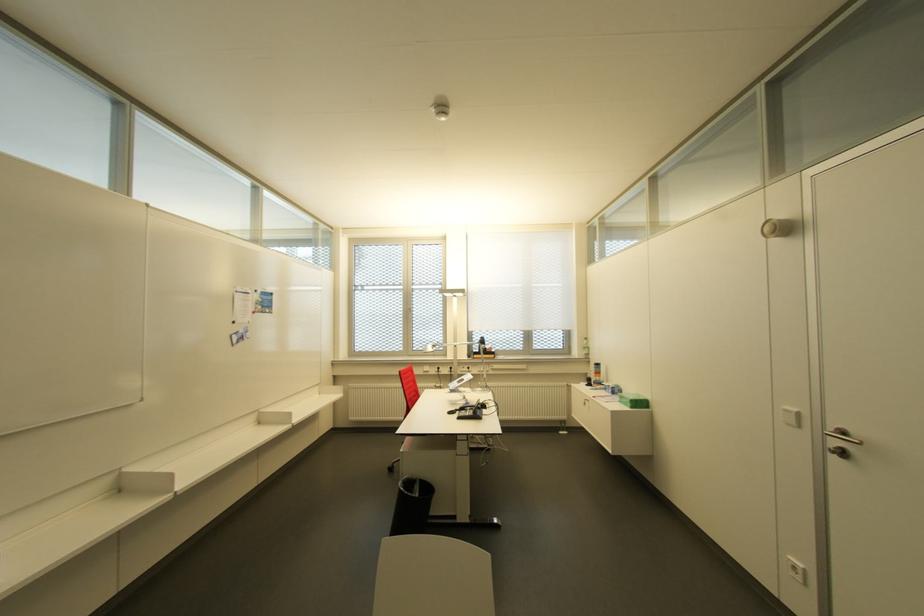
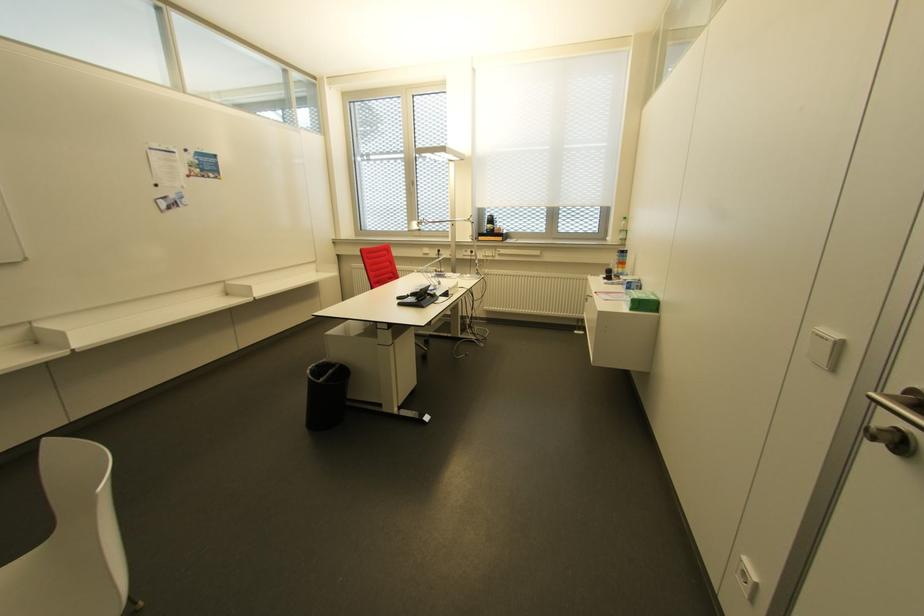
Where in the second image is the point corresponding to (586,355) from the first image?

(623, 240)